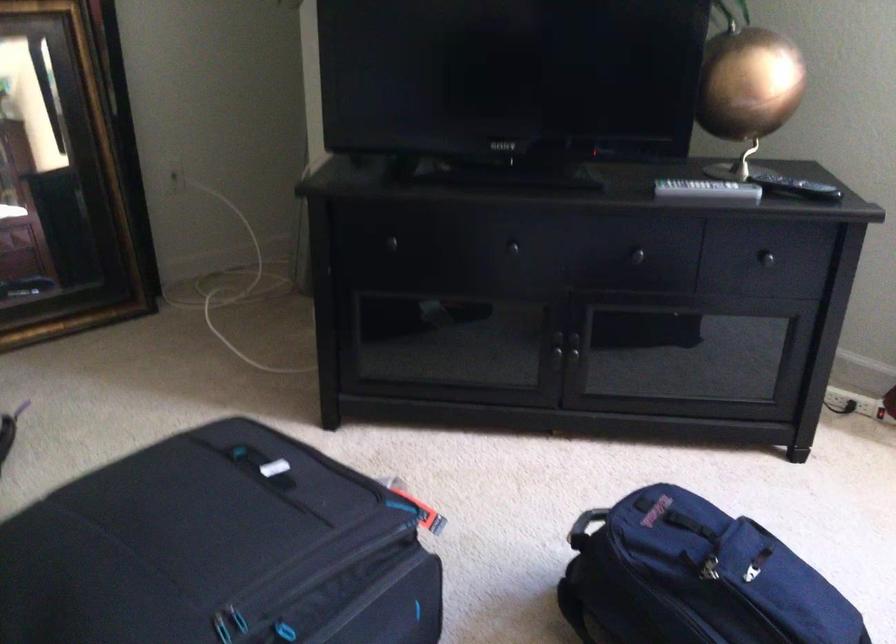
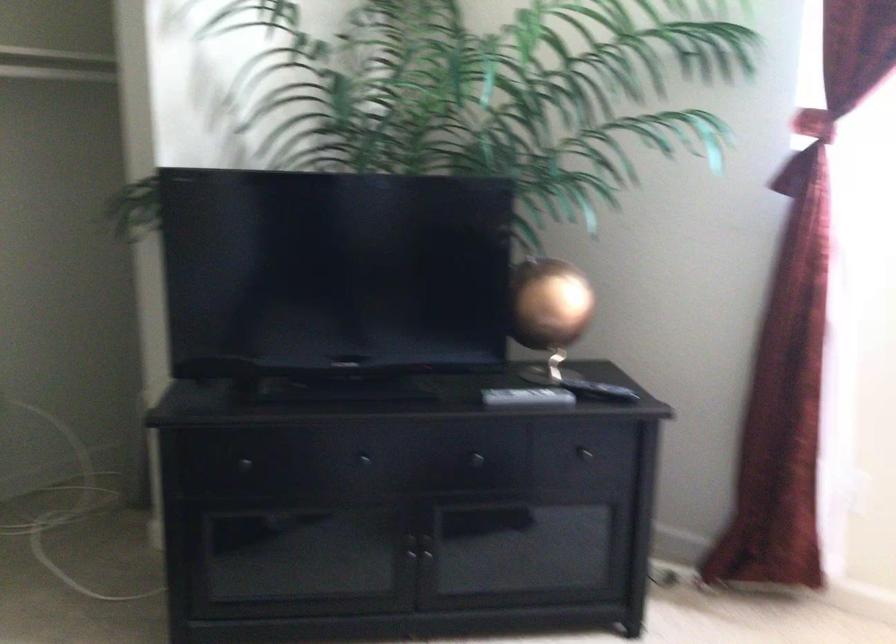
Locate, in the second image, the point that corresponds to point (702, 190) in the first image.

(527, 397)